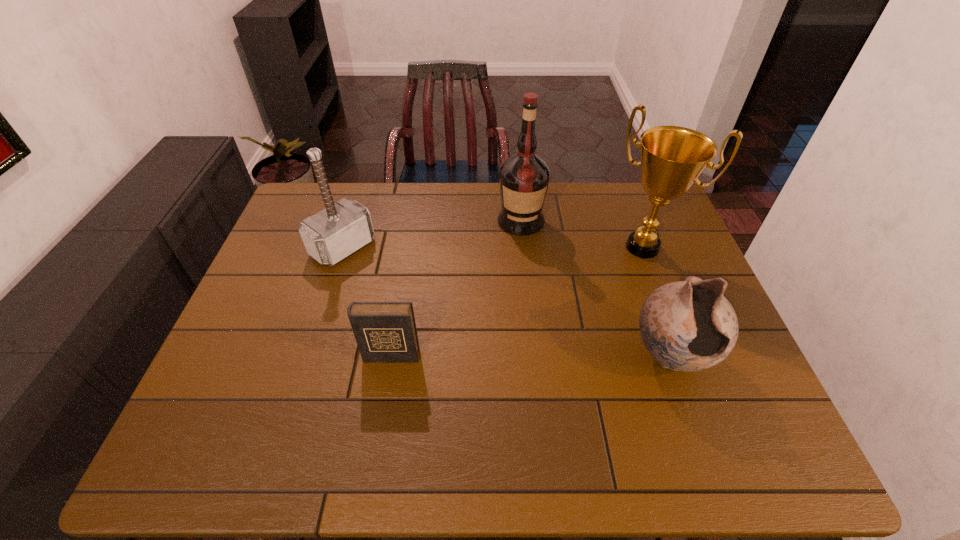
I want to click on vacant spot on the desktop that is between the second object from left to right and the pottery and is positioned on the front view with handles of the award, so click(x=570, y=356).

The image size is (960, 540). Identify the location of free space on the desktop that is between the fourth object from right to left and the pottery and is positioned for striking with the head of the leftmost object. (490, 356).

At what (x,y) coordinates should I click in order to perform the action: click on free spot on the desktop that is between the diary and the second shortest object and is positioned on the surface of the liquor. Please return your answer as a coordinate pair (x, y). The image size is (960, 540). Looking at the image, I should click on (528, 356).